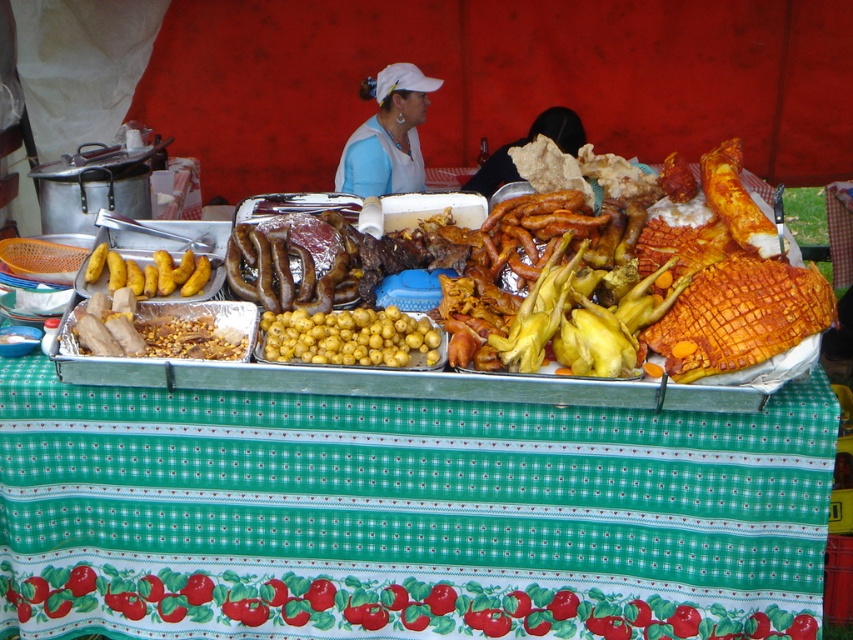
You are a customer at the food stall and want to know if the green glossy tomato at lower center can fit into a container that is the same size as the black fabric at upper center. Can it fit?

The green glossy tomato at lower center is wider than the black fabric at upper center, so it cannot fit into a container the same size as the black fabric at upper center.

You are a customer at the food stall and want to grab both the yellow matte potatoes at left and the black fabric at upper center. However, you can only reach items within 10 feet. Can you reach both items without moving closer?

The yellow matte potatoes at left is 8.57 feet away from the black fabric at upper center. Since the distance between them is within your 10 feet reach, you can reach both items without moving closer.